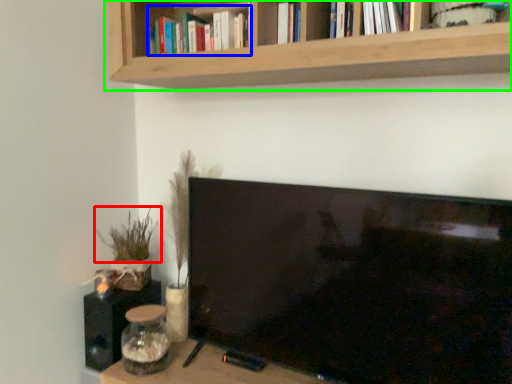
Question: Considering the real-world distances, which object is closest to plant (highlighted by a red box)? book (highlighted by a blue box) or shelf (highlighted by a green box).

Choices:
 (A) book
 (B) shelf

Answer: (A)